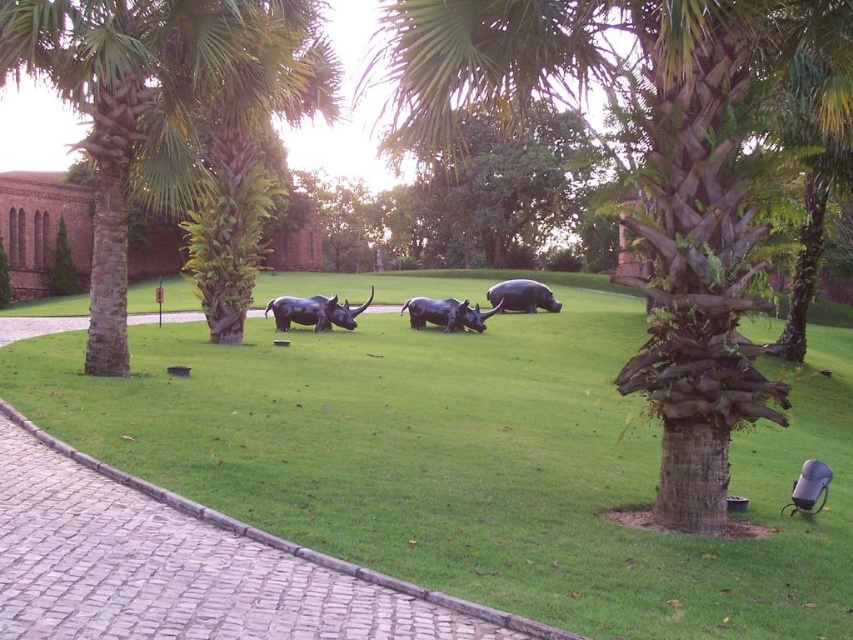
Question: Which point is closer to the camera?

Choices:
 (A) pos(486,296)
 (B) pos(434,316)
 (C) pos(320,300)
 (D) pos(842,621)

Answer: (D)

Question: Considering the real-world distances, which object is farthest from the green grass at center?

Choices:
 (A) polished bronze buffalo at center
 (B) black plastic chair at lower right
 (C) brown textured palm tree at center
 (D) polished black rhino at center

Answer: (A)

Question: Does shiny black buffalo at center have a lesser width compared to black plastic chair at lower right?

Choices:
 (A) no
 (B) yes

Answer: (A)

Question: Does brown textured palm tree at center have a lesser width compared to polished bronze buffalo at center?

Choices:
 (A) no
 (B) yes

Answer: (A)

Question: Among these objects, which one is farthest from the camera?

Choices:
 (A) green grass at center
 (B) polished bronze buffalo at center
 (C) black plastic chair at lower right
 (D) polished black rhino at center

Answer: (B)

Question: Can you confirm if brown textured palm tree at center is wider than shiny black buffalo at center?

Choices:
 (A) no
 (B) yes

Answer: (B)